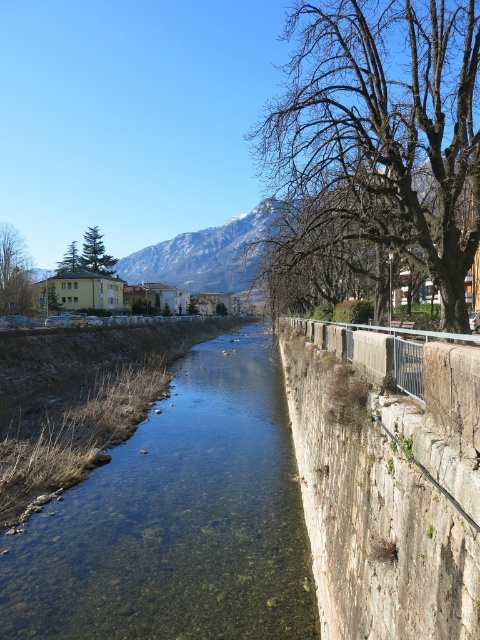
You are a hiker who wants to cross the river using the stone embankment on the right. However, you notice a green leafy tree at left and clear water at center. Which direction should you head to reach the embankment?

You should head to the right of the green leafy tree at left because the clear water at center is to the right of the tree, and the embankment is on the right side of the river.

Based on the scene description, which object takes up more area in the image? Please choose between the clear water at center and the green leafy tree at left.

The green leafy tree at left occupies more area in the image than the clear water at center.